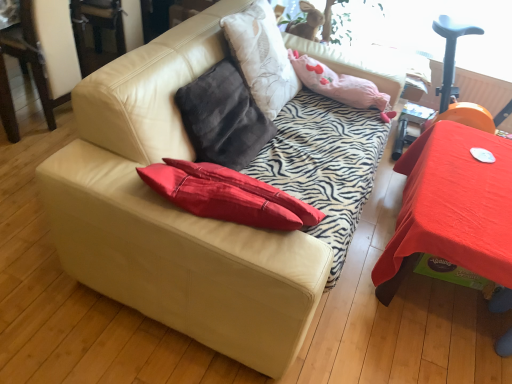
At what (x,y) coordinates should I click in order to perform the action: click on pink fabric pillow at upper center. Please return your answer as a coordinate pair (x, y). This screenshot has height=384, width=512. Looking at the image, I should click on (339, 85).

You are a GUI agent. You are given a task and a screenshot of the screen. Output one action in this format:
    pyautogui.click(x=<x>, y=<y>)
    Task: Click on the fuzzy beige rabbit at upper center
    This screenshot has height=384, width=512.
    Given the screenshot: What is the action you would take?
    pyautogui.click(x=312, y=22)

What's the angular difference between beige leather couch at center and fuzzy beige rabbit at upper center's facing directions?

The angle between the facing direction of beige leather couch at center and the facing direction of fuzzy beige rabbit at upper center is 90 degrees.

Which point is more distant from viewer, (44, 204) or (309, 9)?

The point (309, 9) is behind.

Can you confirm if beige leather couch at center is bigger than fuzzy beige rabbit at upper center?

Yes, beige leather couch at center is bigger than fuzzy beige rabbit at upper center.

Is beige leather couch at center oriented towards fuzzy beige rabbit at upper center?

No, beige leather couch at center is not aimed at fuzzy beige rabbit at upper center.

Which of these two, pink fabric pillow at upper center or smooth red table at right, stands taller?

With more height is smooth red table at right.

From the image's perspective, which is below, pink fabric pillow at upper center or smooth red table at right?

smooth red table at right appears lower in the image.

Are pink fabric pillow at upper center and smooth red table at right far apart?

They are positioned close to each other.

From a real-world perspective, who is located lower, fuzzy beige rabbit at upper center or pink fabric pillow at upper center?

In real-world perspective, pink fabric pillow at upper center is lower.

From the image's perspective, which is above, fuzzy beige rabbit at upper center or pink fabric pillow at upper center?

fuzzy beige rabbit at upper center is shown above in the image.

Does fuzzy beige rabbit at upper center have a lesser height compared to pink fabric pillow at upper center?

No.

What's the angular difference between fuzzy beige rabbit at upper center and pink fabric pillow at upper center's facing directions?

89.8 degrees.

You are a GUI agent. You are given a task and a screenshot of the screen. Output one action in this format:
    pyautogui.click(x=<x>, y=<y>)
    Task: Click on the pillow that is behind the beige leather couch at center
    The height and width of the screenshot is (384, 512).
    Given the screenshot: What is the action you would take?
    pyautogui.click(x=339, y=85)

Is beige leather couch at center looking in the opposite direction of pink fabric pillow at upper center?

No, beige leather couch at center is not facing away from pink fabric pillow at upper center.

Does point (170, 137) come farther from viewer compared to point (386, 94)?

No, (170, 137) is in front of (386, 94).

Is beige leather couch at center wider or thinner than pink fabric pillow at upper center?

Considering their sizes, beige leather couch at center looks broader than pink fabric pillow at upper center.

Is point (461, 243) less distant than point (334, 89)?

That is True.

From the image's perspective, which object appears higher, smooth red table at right or pink fabric pillow at upper center?

pink fabric pillow at upper center, from the image's perspective.

Which is more to the right, smooth red table at right or pink fabric pillow at upper center?

smooth red table at right.

Who is bigger, smooth red table at right or pink fabric pillow at upper center?

smooth red table at right is bigger.

Which object is thinner, smooth red table at right or beige leather couch at center?

smooth red table at right is thinner.

From the image's perspective, is smooth red table at right under beige leather couch at center?

Yes, from the image's perspective, smooth red table at right is below beige leather couch at center.

In the image, is smooth red table at right positioned in front of or behind beige leather couch at center?

smooth red table at right is positioned farther from the viewer than beige leather couch at center.

From a real-world perspective, relative to beige leather couch at center, is smooth red table at right vertically above or below?

In terms of real-world spatial position, smooth red table at right is below beige leather couch at center.

Which of these two, fuzzy beige rabbit at upper center or smooth red table at right, is thinner?

fuzzy beige rabbit at upper center is thinner.

Consider the image. Considering the relative sizes of fuzzy beige rabbit at upper center and smooth red table at right in the image provided, is fuzzy beige rabbit at upper center bigger than smooth red table at right?

Actually, fuzzy beige rabbit at upper center might be smaller than smooth red table at right.

Is fuzzy beige rabbit at upper center positioned beyond the bounds of smooth red table at right?

Absolutely, fuzzy beige rabbit at upper center is external to smooth red table at right.

Which point is more distant from viewer, (312, 8) or (386, 298)?

The point (312, 8) is farther.

Locate an element on the screen. Image resolution: width=512 pixels, height=384 pixels. animal to the right of beige leather couch at center is located at coordinates (312, 22).

Find the location of a particular element. pillow located on the left of smooth red table at right is located at coordinates (339, 85).

Looking at the image, which one is located closer to pink fabric pillow at upper center, fuzzy beige rabbit at upper center or smooth red table at right?

fuzzy beige rabbit at upper center lies closer to pink fabric pillow at upper center than the other object.

From the image, which object appears to be farther from pink fabric pillow at upper center, beige leather couch at center or fuzzy beige rabbit at upper center?

Based on the image, beige leather couch at center appears to be further to pink fabric pillow at upper center.

Considering their positions, is smooth red table at right positioned closer to beige leather couch at center than fuzzy beige rabbit at upper center?

smooth red table at right lies closer to beige leather couch at center than the other object.

Looking at the image, which one is located closer to fuzzy beige rabbit at upper center, beige leather couch at center or smooth red table at right?

smooth red table at right is closer to fuzzy beige rabbit at upper center.

Estimate the real-world distances between objects in this image. Which object is closer to smooth red table at right, fuzzy beige rabbit at upper center or pink fabric pillow at upper center?

Among the two, pink fabric pillow at upper center is located nearer to smooth red table at right.

In the scene shown: Considering their positions, is smooth red table at right positioned further to fuzzy beige rabbit at upper center than pink fabric pillow at upper center?

smooth red table at right.

Looking at the image, which one is located closer to fuzzy beige rabbit at upper center, pink fabric pillow at upper center or beige leather couch at center?

Answer: The object closer to fuzzy beige rabbit at upper center is pink fabric pillow at upper center.

Which object lies further to the anchor point smooth red table at right, beige leather couch at center or fuzzy beige rabbit at upper center?

fuzzy beige rabbit at upper center lies further to smooth red table at right than the other object.

The height and width of the screenshot is (384, 512). Identify the location of pillow positioned between beige leather couch at center and fuzzy beige rabbit at upper center from near to far. (339, 85).

Where is `pillow between fuzzy beige rabbit at upper center and smooth red table at right vertically`? Image resolution: width=512 pixels, height=384 pixels. pillow between fuzzy beige rabbit at upper center and smooth red table at right vertically is located at coordinates (339, 85).

What are the coordinates of `table between beige leather couch at center and fuzzy beige rabbit at upper center along the z-axis` in the screenshot? It's located at (451, 207).

This screenshot has width=512, height=384. What are the coordinates of `table positioned between beige leather couch at center and pink fabric pillow at upper center from near to far` in the screenshot? It's located at (451, 207).